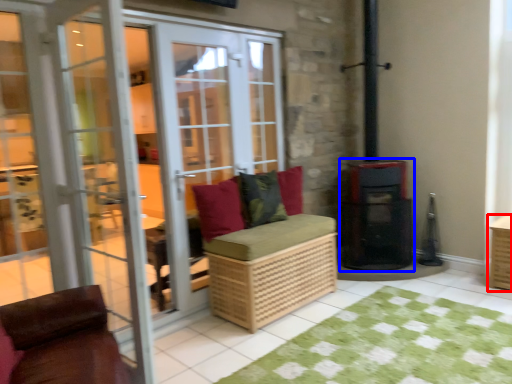
Question: Which object is further to the camera taking this photo, crate (highlighted by a red box) or appliance (highlighted by a blue box)?

Choices:
 (A) crate
 (B) appliance

Answer: (B)